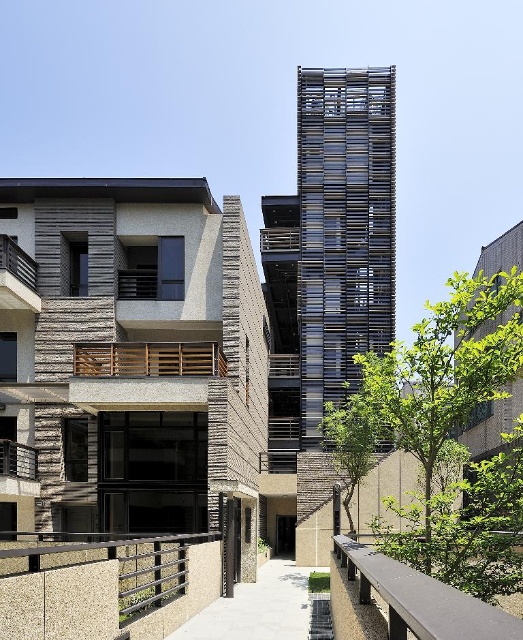
Does smooth gray balustrade at lower center appear over wooden slats balcony at left?

No.

The height and width of the screenshot is (640, 523). What do you see at coordinates (423, 600) in the screenshot?
I see `smooth gray balustrade at lower center` at bounding box center [423, 600].

Which is in front, point (460, 600) or point (31, 298)?

Point (460, 600) is in front.

This screenshot has height=640, width=523. Identify the location of smooth gray balustrade at lower center. (423, 600).

Who is more distant from viewer, (178, 586) or (13, 300)?

Point (13, 300)

Does point (147, 541) come closer to viewer compared to point (33, 280)?

Yes, point (147, 541) is closer to viewer.

Locate an element on the screen. The height and width of the screenshot is (640, 523). metallic textured railing at lower center is located at coordinates (118, 564).

Is point (390, 618) positioned before point (119, 369)?

Yes, point (390, 618) is closer to viewer.

Can you confirm if smooth gray balustrade at lower center is positioned to the left of wooden slats at center?

In fact, smooth gray balustrade at lower center is to the right of wooden slats at center.

Which is in front, point (444, 589) or point (146, 368)?

Positioned in front is point (444, 589).

I want to click on smooth gray balustrade at lower center, so click(423, 600).